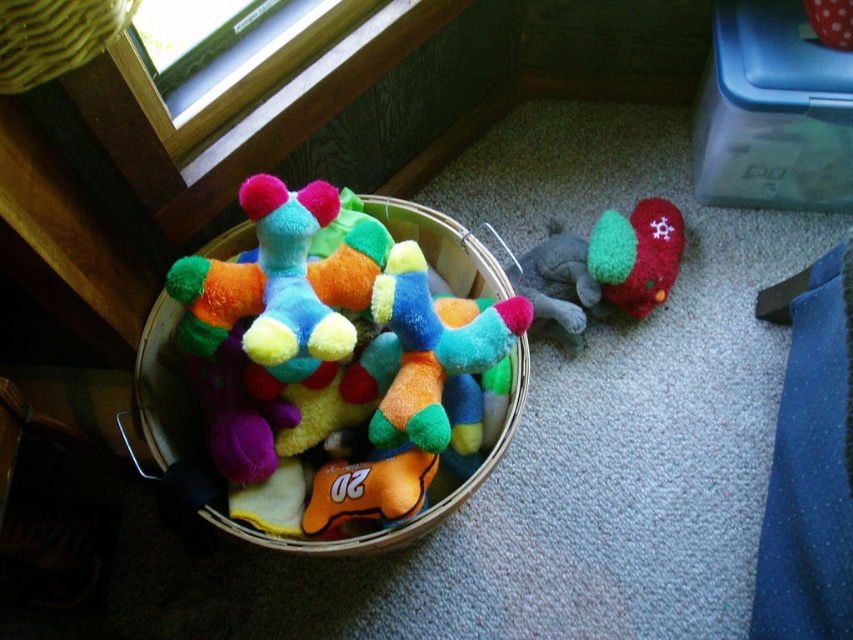
Question: Is soft fabric stuffed animals at center smaller than yellow woven basket at upper left?

Choices:
 (A) no
 (B) yes

Answer: (A)

Question: Can you confirm if soft fabric stuffed animals at center is positioned to the right of yellow woven basket at upper left?

Choices:
 (A) yes
 (B) no

Answer: (A)

Question: Which object is positioned farthest from the velvety green plush toy at lower right?

Choices:
 (A) soft fabric stuffed animals at center
 (B) yellow woven basket at upper left

Answer: (B)

Question: Estimate the real-world distances between objects in this image. Which object is farther from the velvety green plush toy at lower right?

Choices:
 (A) soft fabric stuffed animals at center
 (B) yellow woven basket at upper left

Answer: (B)

Question: Among these objects, which one is farthest from the camera?

Choices:
 (A) yellow woven basket at upper left
 (B) soft fabric stuffed animals at center
 (C) velvety green plush toy at lower right

Answer: (C)

Question: Can you confirm if soft fabric stuffed animals at center is bigger than yellow woven basket at upper left?

Choices:
 (A) yes
 (B) no

Answer: (A)